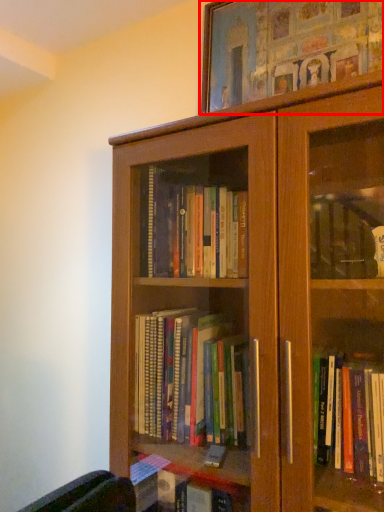
Question: From the image, what is the correct spatial relationship of picture frame (annotated by the red box) in relation to bookcase?

Choices:
 (A) left
 (B) right

Answer: (B)